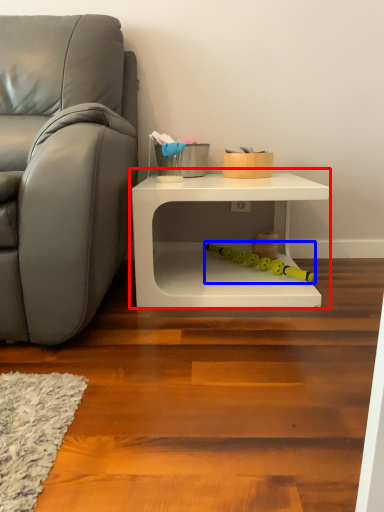
Question: Which point is closer to the camera, table (highlighted by a red box) or toy (highlighted by a blue box)?

Choices:
 (A) table
 (B) toy

Answer: (A)